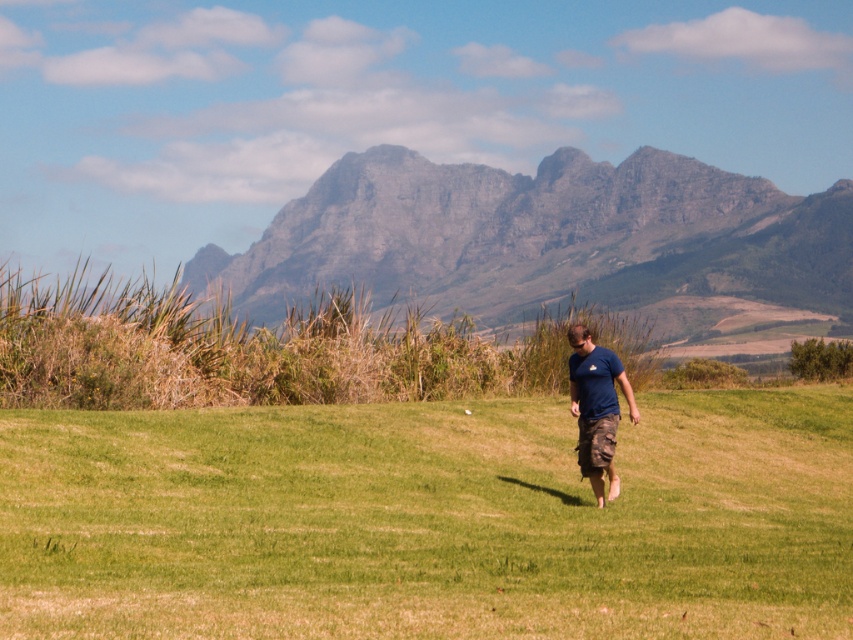
You are a hiker planning to cross the green grass at center and the gray rock mountain at center. Which terrain is lower in elevation?

The green grass at center is below the gray rock mountain at center, so the green grass at center is lower in elevation.